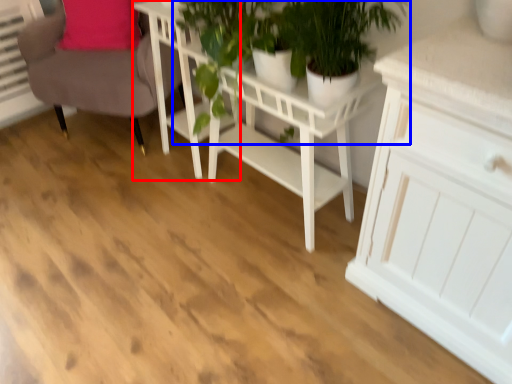
Question: Among these objects, which one is farthest to the camera, table (highlighted by a red box) or houseplant (highlighted by a blue box)?

Choices:
 (A) table
 (B) houseplant

Answer: (A)